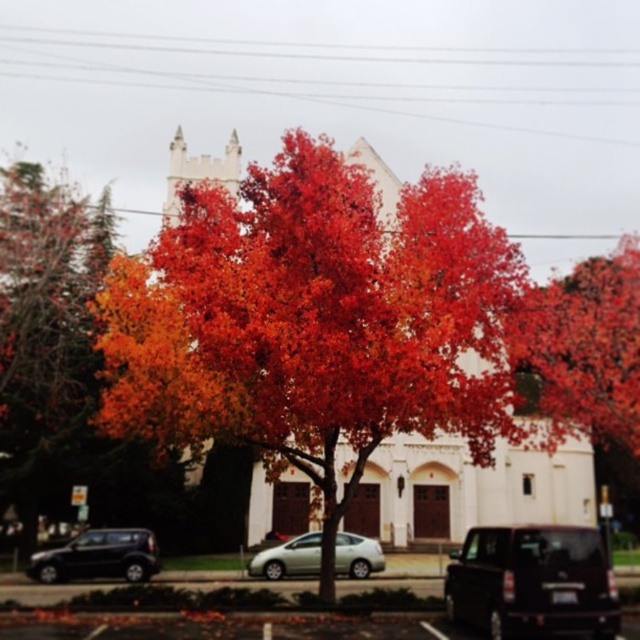
How much distance is there between vivid orange leaves at center and shiny black suv at lower right?

vivid orange leaves at center and shiny black suv at lower right are 12.25 meters apart.

Does point (483, 368) lie behind point (493, 540)?

That is True.

Is point (224, 396) more distant than point (529, 540)?

Yes, it is behind point (529, 540).

In order to click on vivid orange leaves at center in this screenshot , I will do `click(312, 321)`.

Between shiny red leaves at center and shiny black suv at lower left, which one is positioned lower?

shiny black suv at lower left

Does shiny red leaves at center appear under shiny black suv at lower left?

Actually, shiny red leaves at center is above shiny black suv at lower left.

Does point (566, 388) come farther from viewer compared to point (83, 556)?

Yes, it is.

The width and height of the screenshot is (640, 640). I want to click on shiny red leaves at center, so click(x=582, y=349).

Is shiny orange leaves at left below shiny black suv at lower right?

Incorrect, shiny orange leaves at left is not positioned below shiny black suv at lower right.

Does point (38, 337) come behind point (547, 534)?

Yes, it is behind point (547, 534).

The height and width of the screenshot is (640, 640). Describe the element at coordinates (45, 326) in the screenshot. I see `shiny orange leaves at left` at that location.

Locate an element on the screen. The height and width of the screenshot is (640, 640). shiny orange leaves at left is located at coordinates (45, 326).